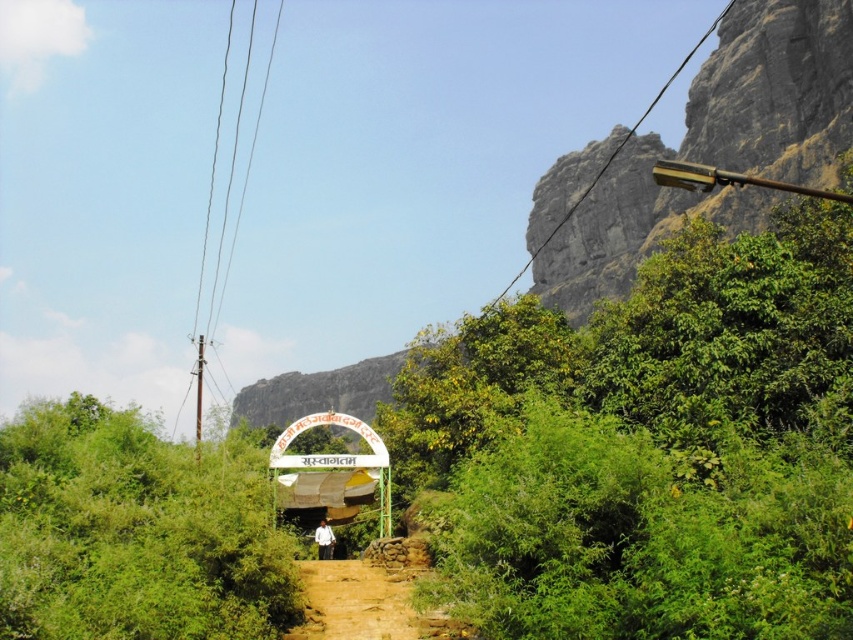
Based on the photo, you are planning a walking path for a new garden and need to know the spatial relationship between the green leafy bush at upper right and the brown dirt track at lower center. Which object is located to the right of the other?

The green leafy bush at upper right is positioned on the right side of brown dirt track at lower center.

You are a hiker trying to find the best path to reach the archway. You see a green leafy bush at upper right and a brown dirt track at lower center. Which object is positioned higher up in the scene?

The green leafy bush at upper right is located above the brown dirt track at lower center, so it is positioned higher up in the scene.